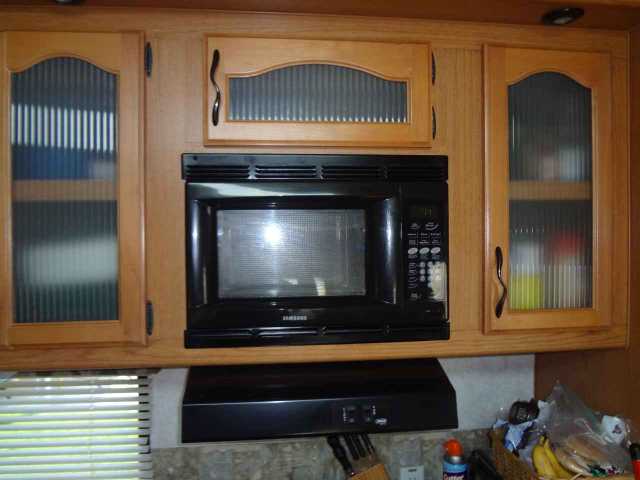
Where is `3 cabinets`? 3 cabinets is located at coordinates (550, 246), (82, 259), (356, 108).